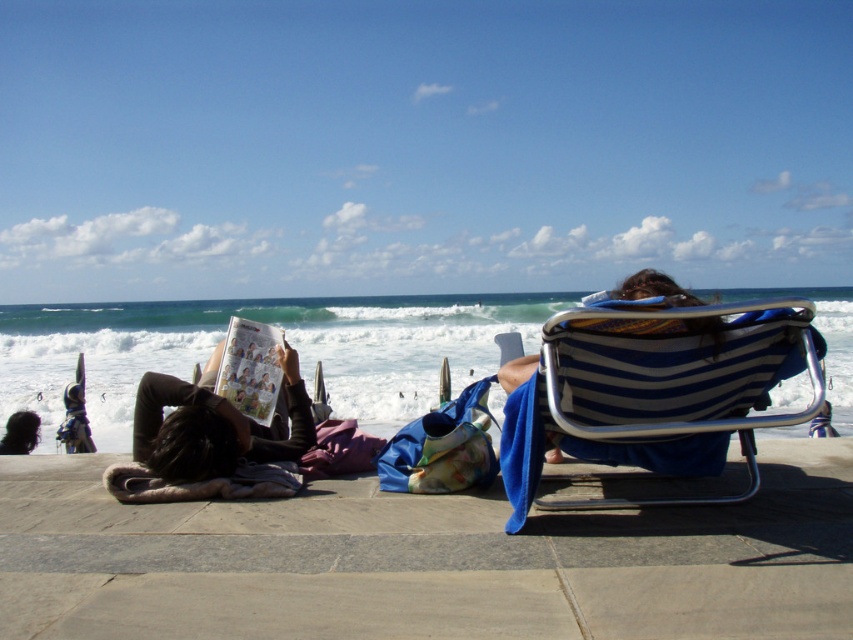
Question: Is blue striped fabric beach chair at right below blue striped chair at center?

Choices:
 (A) yes
 (B) no

Answer: (A)

Question: Can you confirm if matte paper book at center is positioned below blue striped chair at center?

Choices:
 (A) no
 (B) yes

Answer: (B)

Question: Can you confirm if beige concrete sidewalk at lower center is smaller than blue striped chair at center?

Choices:
 (A) yes
 (B) no

Answer: (B)

Question: Which is farther from the beige concrete sidewalk at lower center?

Choices:
 (A) blue striped fabric beach chair at right
 (B) blue striped chair at center

Answer: (B)

Question: Which object appears farthest from the camera in this image?

Choices:
 (A) blue striped chair at center
 (B) blue striped fabric beach chair at right
 (C) matte paper book at center

Answer: (C)

Question: Which object is positioned closest to the matte paper book at center?

Choices:
 (A) blue striped chair at center
 (B) beige concrete sidewalk at lower center
 (C) blue striped fabric beach chair at right

Answer: (B)